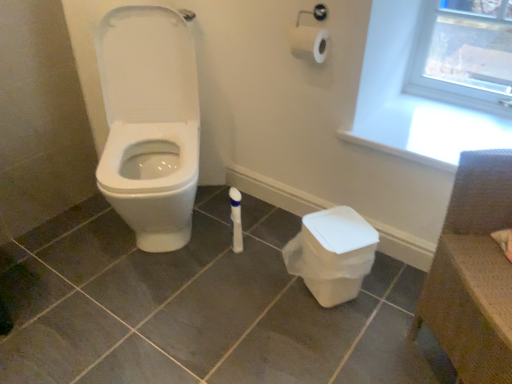
Question: Should I look upward or downward to see white plastic window frame at upper right?

Choices:
 (A) down
 (B) up

Answer: (B)

Question: Is white plastic window frame at upper right far from white plastic potty at lower right?

Choices:
 (A) no
 (B) yes

Answer: (A)

Question: From the image's perspective, is white plastic window frame at upper right located above white plastic potty at lower right?

Choices:
 (A) no
 (B) yes

Answer: (B)

Question: Considering the relative sizes of white plastic window frame at upper right and white plastic potty at lower right in the image provided, is white plastic window frame at upper right smaller than white plastic potty at lower right?

Choices:
 (A) yes
 (B) no

Answer: (B)

Question: Is white plastic window frame at upper right oriented away from white plastic potty at lower right?

Choices:
 (A) no
 (B) yes

Answer: (A)

Question: Can you see white plastic window frame at upper right touching white plastic potty at lower right?

Choices:
 (A) yes
 (B) no

Answer: (B)

Question: Considering the relative positions of white plastic window frame at upper right and white plastic potty at lower right in the image provided, is white plastic window frame at upper right behind white plastic potty at lower right?

Choices:
 (A) yes
 (B) no

Answer: (A)

Question: From the image's perspective, would you say brown woven chair at upper right is positioned over white plastic potty at lower right?

Choices:
 (A) yes
 (B) no

Answer: (A)

Question: Does brown woven chair at upper right have a greater width compared to white plastic potty at lower right?

Choices:
 (A) no
 (B) yes

Answer: (B)

Question: Is the depth of brown woven chair at upper right greater than that of white plastic potty at lower right?

Choices:
 (A) yes
 (B) no

Answer: (B)

Question: From the image's perspective, would you say brown woven chair at upper right is shown under white plastic potty at lower right?

Choices:
 (A) yes
 (B) no

Answer: (B)

Question: Is white plastic potty at lower right a part of brown woven chair at upper right?

Choices:
 (A) yes
 (B) no

Answer: (B)

Question: Is brown woven chair at upper right smaller than white plastic potty at lower right?

Choices:
 (A) yes
 (B) no

Answer: (B)

Question: From the image's perspective, is white plastic window frame at upper right beneath brown woven chair at upper right?

Choices:
 (A) no
 (B) yes

Answer: (A)